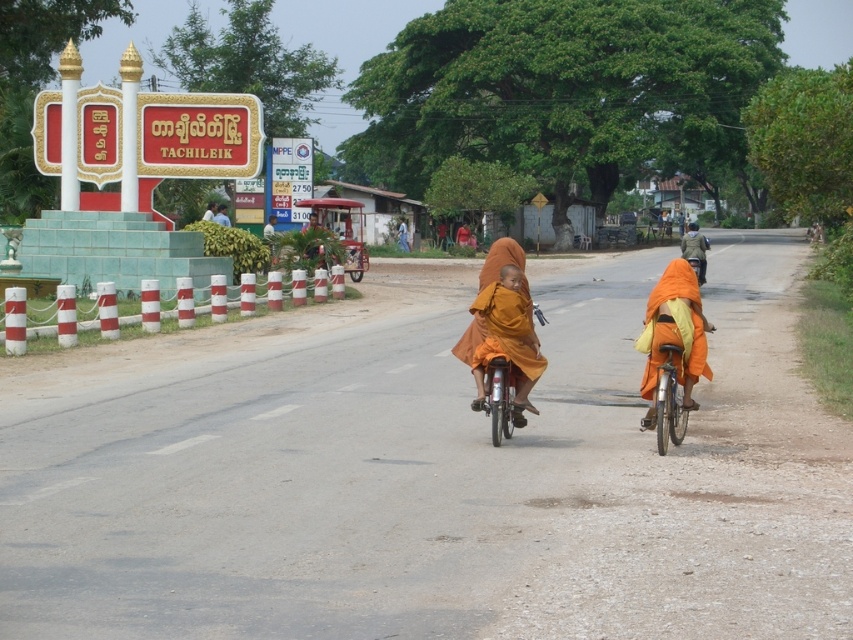
What do you see at coordinates (498, 397) in the screenshot? Image resolution: width=853 pixels, height=640 pixels. I see `metallic orange bicycle at center` at bounding box center [498, 397].

In the scene shown: Can you confirm if metallic orange bicycle at center is bigger than camouflage fabric jacket at right?

No, metallic orange bicycle at center is not bigger than camouflage fabric jacket at right.

I want to click on metallic orange bicycle at center, so click(498, 397).